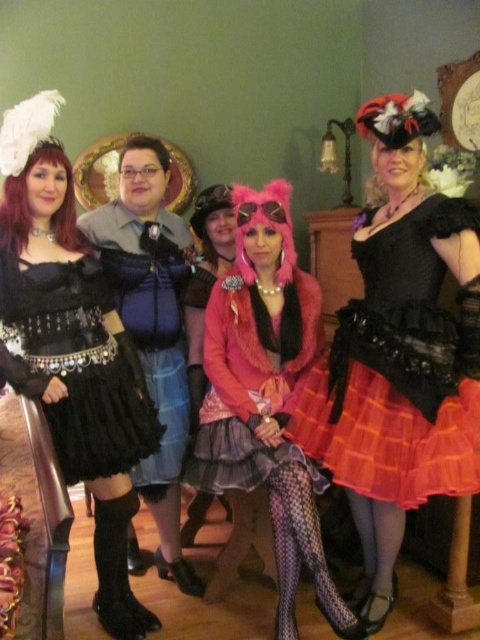
Question: Does fuzzy pink jacket at center lie behind pink fuzzy sweater at center?

Choices:
 (A) yes
 (B) no

Answer: (B)

Question: Which point is farther from the camera taking this photo?

Choices:
 (A) (74, 352)
 (B) (40, 316)
 (C) (409, 385)
 (D) (321, 545)

Answer: (D)

Question: Which point is farther from the camera taking this photo?

Choices:
 (A) (455, 212)
 (B) (90, 310)
 (C) (32, 99)

Answer: (C)

Question: Which is nearer to the black satin dress at left?

Choices:
 (A) pink fuzzy sweater at center
 (B) matte blue fabric at center
 (C) fuzzy pink jacket at center
 (D) orange plaid skirt at center

Answer: (B)

Question: Can you confirm if matte blue fabric at center is smaller than pink fuzzy sweater at center?

Choices:
 (A) yes
 (B) no

Answer: (B)

Question: Is orange plaid skirt at center above fuzzy pink jacket at center?

Choices:
 (A) yes
 (B) no

Answer: (A)